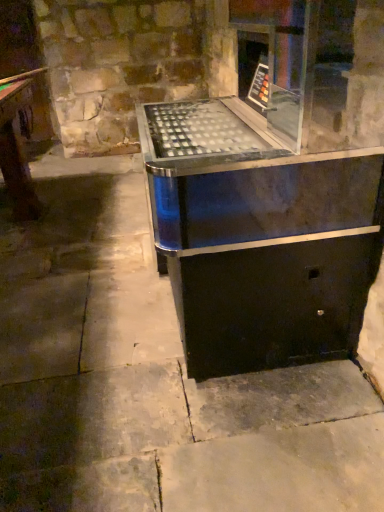
The width and height of the screenshot is (384, 512). What are the coordinates of `shiny black cabinet at center` in the screenshot? It's located at (274, 191).

This screenshot has height=512, width=384. Describe the element at coordinates (274, 191) in the screenshot. I see `shiny black cabinet at center` at that location.

Identify the location of shiny black cabinet at center. Image resolution: width=384 pixels, height=512 pixels. (274, 191).